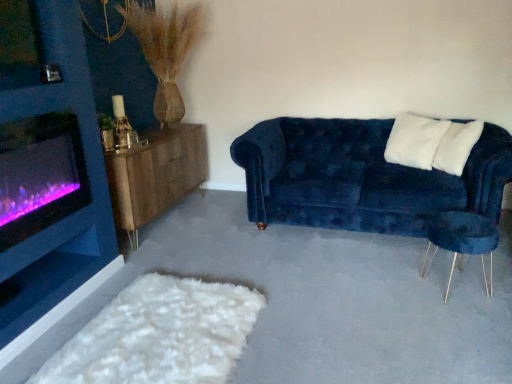
Question: Considering the positions of white fluffy pillow at upper right, marked as the 2th pillow in a left-to-right arrangement, and purple glass wood burning stove at left in the image, is white fluffy pillow at upper right, marked as the 2th pillow in a left-to-right arrangement, bigger or smaller than purple glass wood burning stove at left?

Choices:
 (A) big
 (B) small

Answer: (B)

Question: Is white fluffy pillow at upper right, marked as the 2th pillow in a left-to-right arrangement, situated inside purple glass wood burning stove at left or outside?

Choices:
 (A) outside
 (B) inside

Answer: (A)

Question: Based on their relative distances, which object is nearer to the wooden sideboard at left?

Choices:
 (A) white soft pillow at upper right, the second pillow positioned from the right
 (B) white fluffy pillow at upper right, the 1th pillow when ordered from right to left
 (C) velvet blue armchair at right
 (D) velvet blue couch at right
 (E) purple glass wood burning stove at left

Answer: (E)

Question: Which of these objects is positioned farthest from the white soft pillow at upper right, the second pillow positioned from the right?

Choices:
 (A) white fluffy pillow at upper right, the 1th pillow when ordered from right to left
 (B) wooden sideboard at left
 (C) velvet blue armchair at right
 (D) purple glass wood burning stove at left
 (E) velvet blue couch at right

Answer: (D)